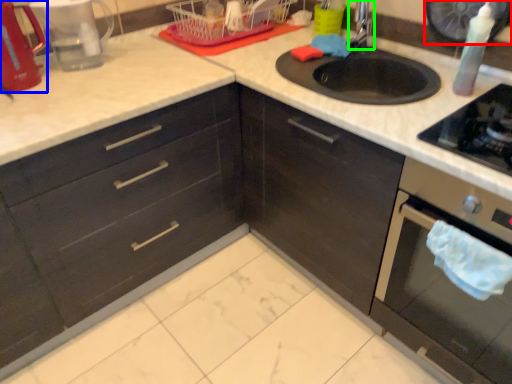
Question: Which object is the closest to the appliance (highlighted by a red box)? Choose among these: appliance (highlighted by a blue box) or faucet (highlighted by a green box).

Choices:
 (A) appliance
 (B) faucet

Answer: (B)